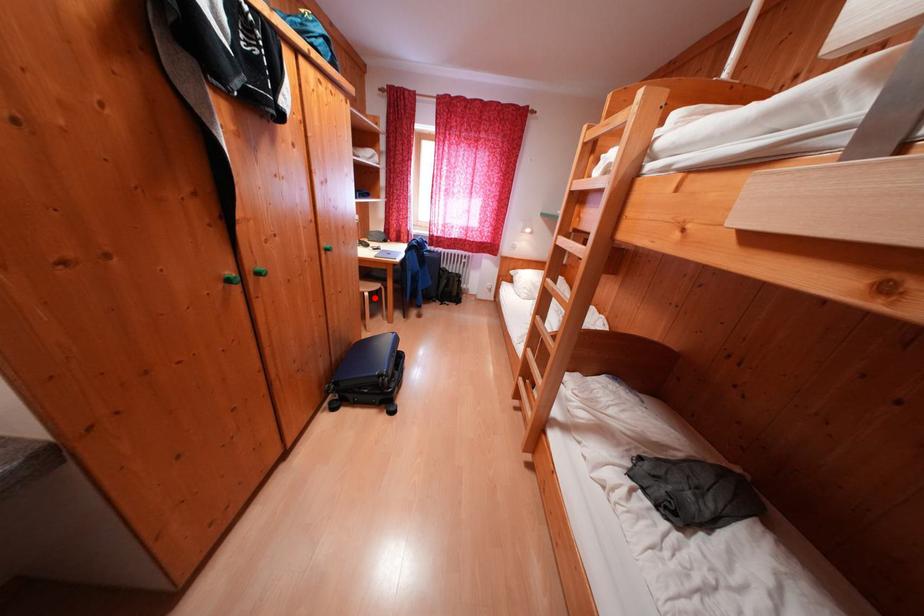
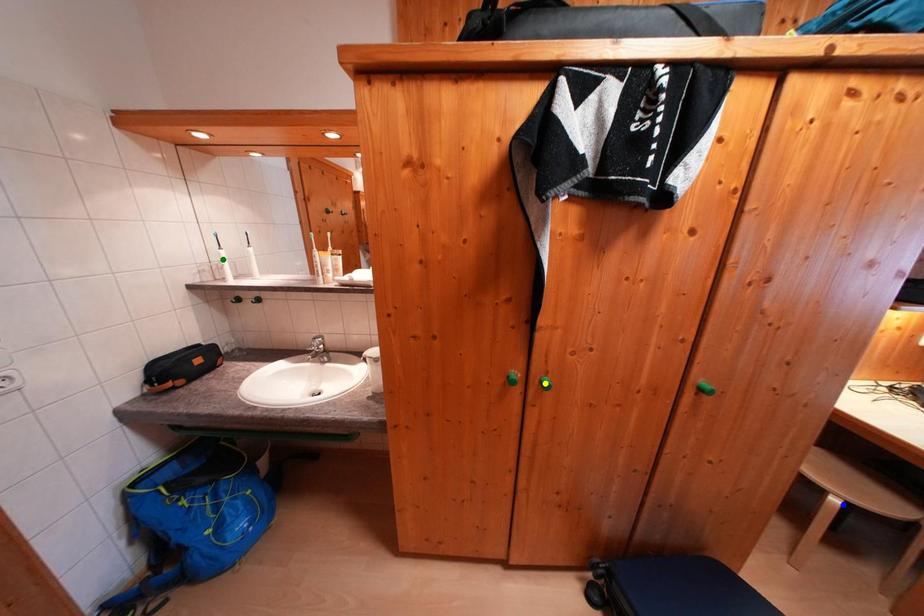
Question: I am providing you with two images of the same scene from different viewpoints. A red point is marked on the first image. You are given multiple points on the second image. Which mark in image 2 goes with the point in image 1?

Choices:
 (A) yellow point
 (B) green point
 (C) blue point

Answer: (C)